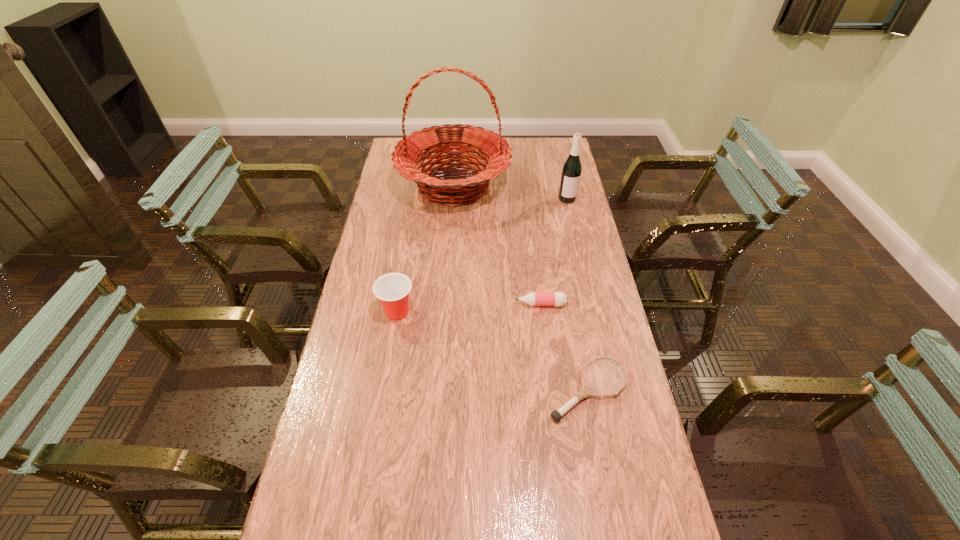
The image size is (960, 540). I want to click on unoccupied area between the second shortest object and the basket, so click(x=497, y=245).

You are a GUI agent. You are given a task and a screenshot of the screen. Output one action in this format:
    pyautogui.click(x=<x>, y=<y>)
    Task: Click on the object identified as the fourth closest to the tennis racket
    
    Given the screenshot: What is the action you would take?
    pyautogui.click(x=571, y=172)

The height and width of the screenshot is (540, 960). In order to click on the second closest object to the fourth shortest object in this screenshot , I will do `click(558, 299)`.

Where is `blank space that satisfies the following two spatial constraints: 1. on the front side of the tallest object; 2. on the left side of the shortest object`? This screenshot has width=960, height=540. blank space that satisfies the following two spatial constraints: 1. on the front side of the tallest object; 2. on the left side of the shortest object is located at coordinates (440, 389).

Locate an element on the screen. This screenshot has width=960, height=540. free location that satisfies the following two spatial constraints: 1. on the label of the second tallest object; 2. with the cap open on the fourth tallest object is located at coordinates (591, 304).